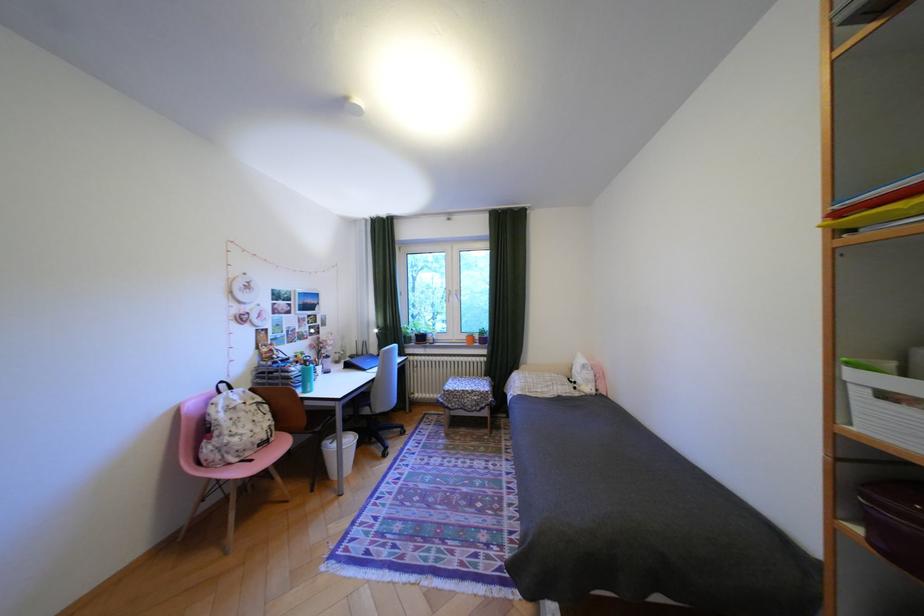
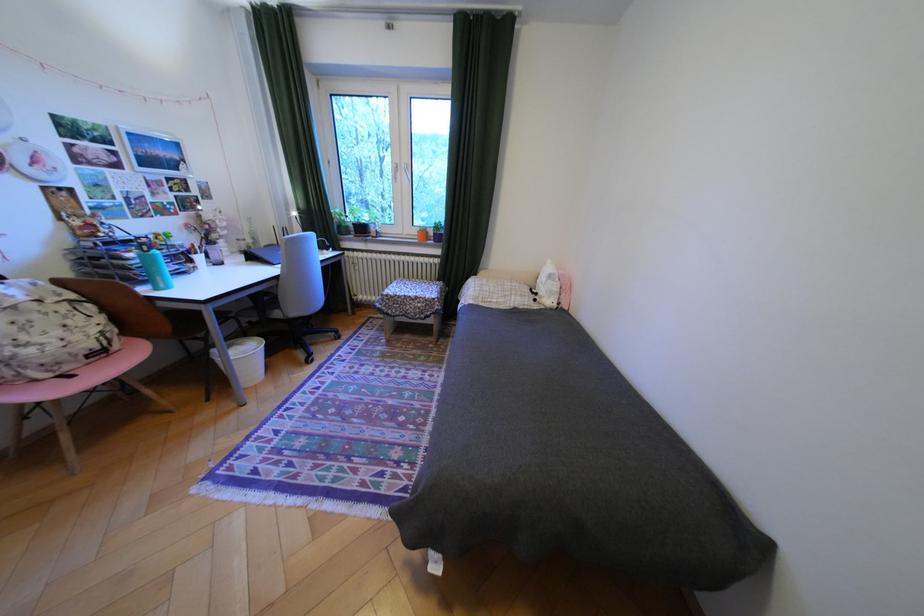
In the second image, find the point that corresponds to the point at 421,338 in the first image.

(359, 227)